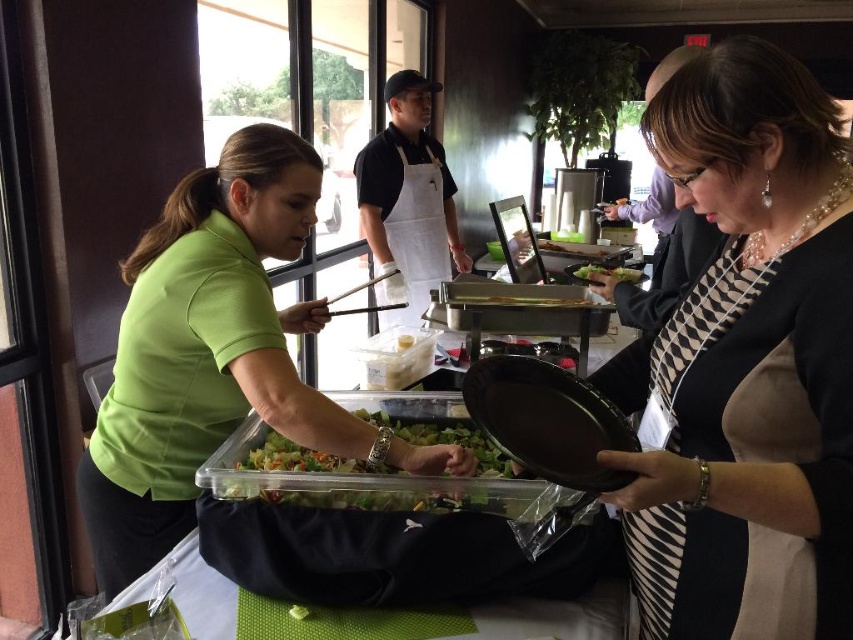
From the picture: Can you confirm if green matte shirt at center is wider than green leafy salad at center?

Correct, the width of green matte shirt at center exceeds that of green leafy salad at center.

You are a GUI agent. You are given a task and a screenshot of the screen. Output one action in this format:
    pyautogui.click(x=<x>, y=<y>)
    Task: Click on the green matte shirt at center
    
    Given the screenshot: What is the action you would take?
    pyautogui.click(x=213, y=353)

Can you confirm if translucent plastic salad at center is smaller than white cotton apron at center?

Indeed, translucent plastic salad at center has a smaller size compared to white cotton apron at center.

Can you confirm if translucent plastic salad at center is positioned to the right of white cotton apron at center?

Incorrect, translucent plastic salad at center is not on the right side of white cotton apron at center.

Between point (405, 413) and point (434, 269), which one is positioned in front?

Point (405, 413)

Where is `translucent plastic salad at center`? The width and height of the screenshot is (853, 640). translucent plastic salad at center is located at coordinates (364, 468).

Who is positioned more to the right, black and white striped dress at center or white cotton apron at center?

Positioned to the right is black and white striped dress at center.

Does black and white striped dress at center lie behind white cotton apron at center?

No, it is in front of white cotton apron at center.

Who is more distant from viewer, (833,577) or (428,256)?

The point (428,256) is behind.

Identify the location of black and white striped dress at center. (746, 364).